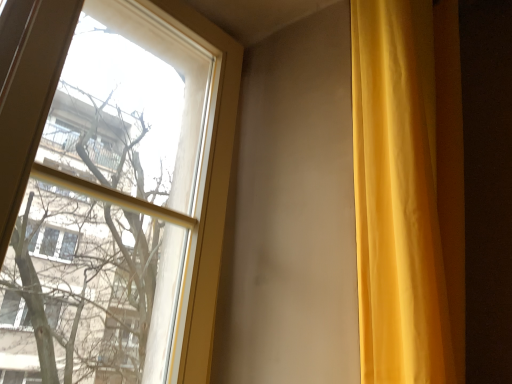
The image size is (512, 384). What do you see at coordinates (114, 193) in the screenshot?
I see `transparent glass window at upper left` at bounding box center [114, 193].

Locate an element on the screen. The image size is (512, 384). transparent glass window at upper left is located at coordinates (114, 193).

At what (x,y) coordinates should I click in order to perform the action: click on transparent glass window at upper left. Please return your answer as a coordinate pair (x, y). The image size is (512, 384). Looking at the image, I should click on (114, 193).